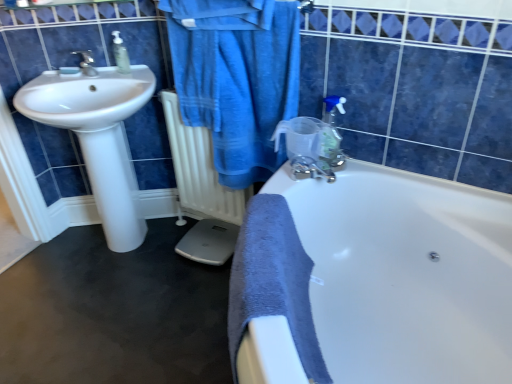
Question: Relative to clear plastic soap dispenser at upper left, positioned as the first soap dispenser in left-to-right order, is white matte radiator at center in front or behind?

Choices:
 (A) front
 (B) behind

Answer: (A)

Question: Considering the relative positions of white matte radiator at center and clear plastic soap dispenser at upper left, acting as the 2th soap dispenser starting from the bottom, in the image provided, is white matte radiator at center to the left or to the right of clear plastic soap dispenser at upper left, acting as the 2th soap dispenser starting from the bottom,?

Choices:
 (A) right
 (B) left

Answer: (A)

Question: Which object is the farthest from the translucent plastic soap dispenser at upper right, the first soap dispenser positioned from the bottom?

Choices:
 (A) clear plastic soap dispenser at upper left, the 1th soap dispenser when ordered from back to front
 (B) blue cotton bathrobe at upper center
 (C) white glossy bathtub at center
 (D) white glossy sink at left
 (E) white matte radiator at center

Answer: (A)

Question: Which object is the farthest from the white glossy bathtub at center?

Choices:
 (A) white glossy sink at left
 (B) white matte radiator at center
 (C) translucent plastic soap dispenser at upper right, the 1th soap dispenser from the front
 (D) clear plastic soap dispenser at upper left, which is counted as the first soap dispenser, starting from the top
 (E) blue cotton bathrobe at upper center

Answer: (D)